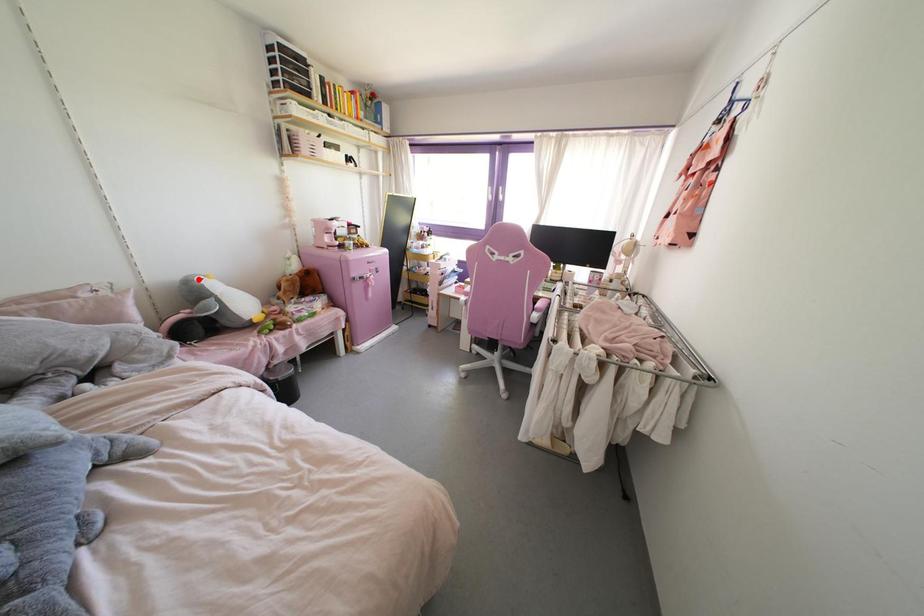
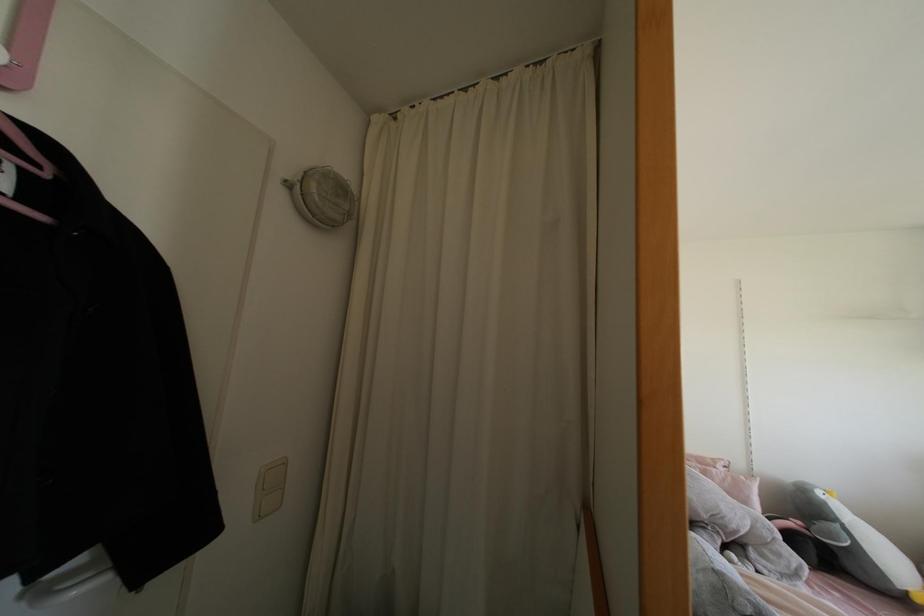
Question: A red point is marked in image1. In image2, is the corresponding 3D point closer to the camera or farther? Reply with the corresponding letter.

Choices:
 (A) The corresponding 3D point is closer.
 (B) The corresponding 3D point is farther.

Answer: (A)